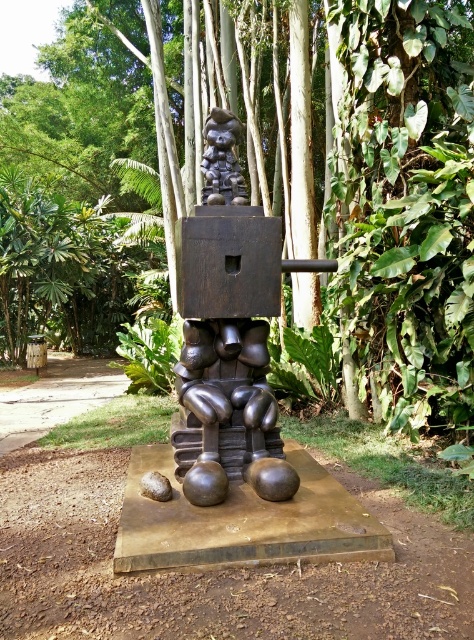
You are standing in the tropical garden and want to take a photo of the sculpture without any obstructions. The green leafy tree at center might block your view. Based on its position, can you determine if the tree is directly in front of the sculpture?

The green leafy tree at center is located at point (261, 179), which is directly in front of the sculpture, so it would obstruct the view.

You are an art student analyzing the sculpture and its surroundings. You notice the green leafy tree at center and the black matte skull at upper center. Which object is closer to you from your current viewpoint?

The green leafy tree at center is closer to you because it is in front of the black matte skull at upper center.